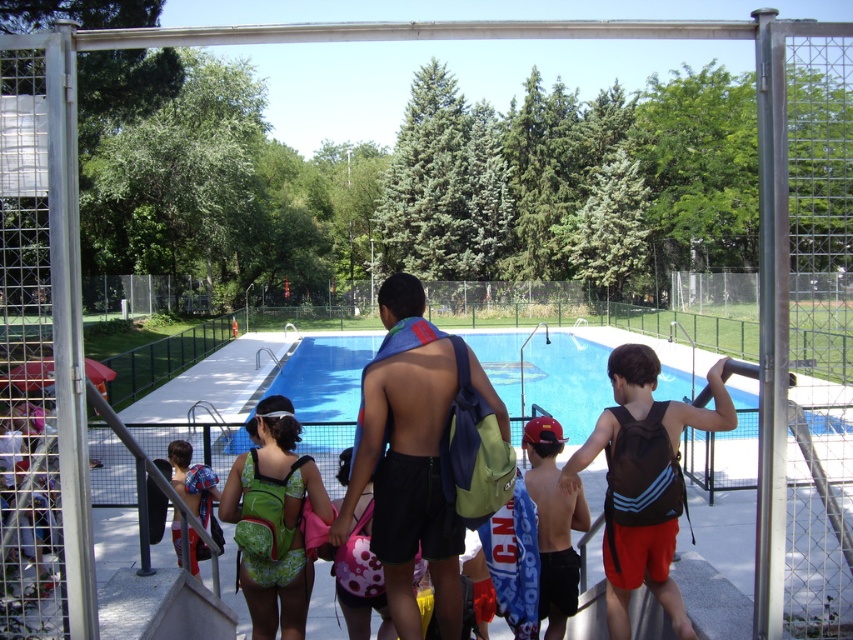
Question: Can you confirm if blue smooth water at center is positioned to the left of red matte cap at center?

Choices:
 (A) no
 (B) yes

Answer: (A)

Question: Which point is farther to the camera?

Choices:
 (A) (653, 452)
 (B) (381, 364)
 (C) (198, 556)

Answer: (C)

Question: Which of these objects is positioned farthest from the green fabric backpack at center?

Choices:
 (A) black matte backpack at center
 (B) green fabric backpack at lower left
 (C) red matte cap at center

Answer: (B)

Question: Which object is positioned closest to the blue smooth water at center?

Choices:
 (A) red matte cap at center
 (B) green fabric backpack at center
 (C) green fabric backpack at lower left

Answer: (A)

Question: Can you confirm if blue smooth water at center is positioned below black matte backpack at center?

Choices:
 (A) no
 (B) yes

Answer: (B)

Question: Where is green fabric backpack at center located in relation to blue smooth water at center in the image?

Choices:
 (A) below
 (B) above

Answer: (B)